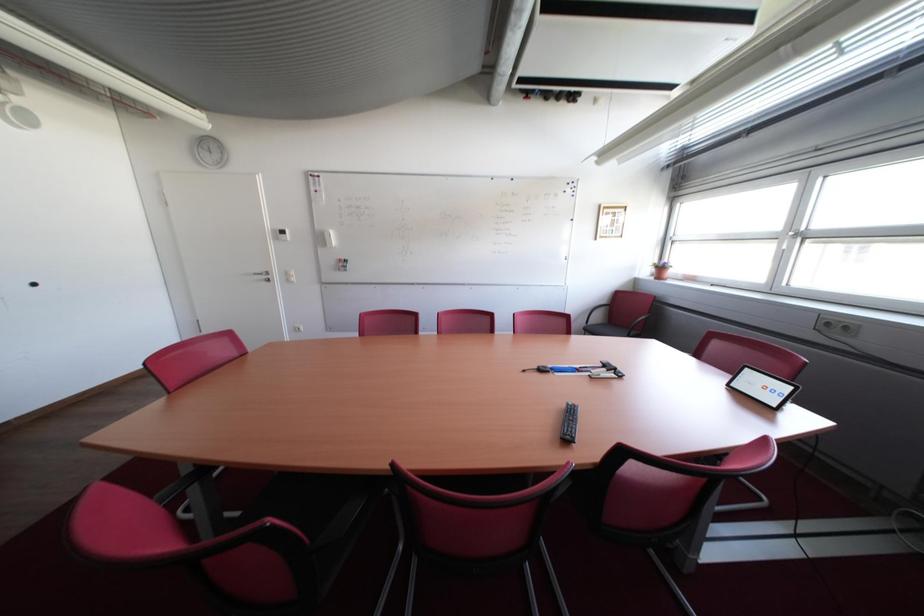
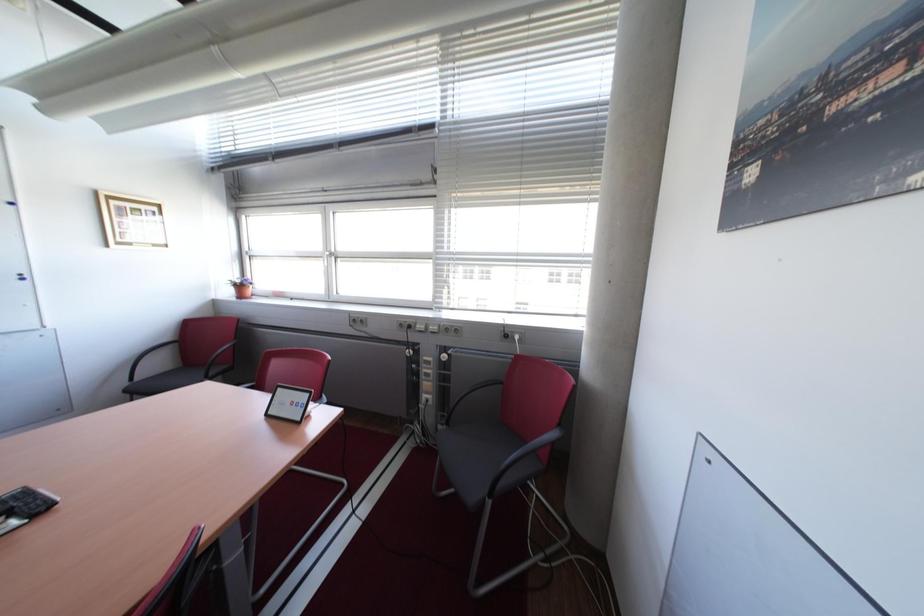
Question: The images are taken continuously from a first-person perspective. In which direction is your viewpoint rotating?

Choices:
 (A) Left
 (B) Right
 (C) Up
 (D) Down

Answer: (B)